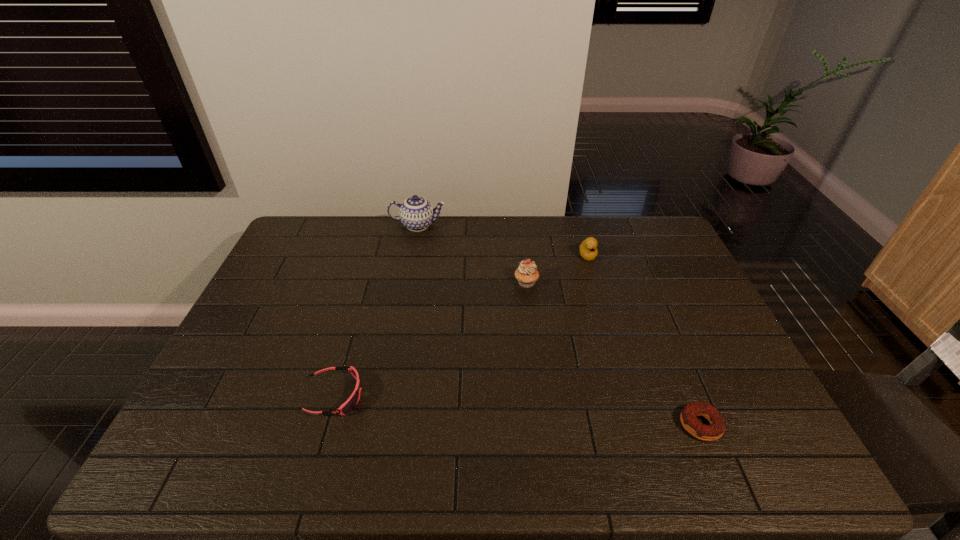
I want to click on the tallest object, so click(416, 213).

Identify the location of chinaware. (416, 213).

I want to click on the third object from right to left, so click(x=526, y=274).

Find the location of a particular element. This screenshot has height=540, width=960. the third nearest object is located at coordinates (526, 274).

Identify the location of the fourth object from left to right. The image size is (960, 540). (588, 251).

Locate an element on the screen. duckling is located at coordinates (588, 251).

Find the location of a particular element. The image size is (960, 540). the second shortest object is located at coordinates (346, 407).

Locate an element on the screen. the rightmost object is located at coordinates (688, 416).

Locate an element on the screen. The width and height of the screenshot is (960, 540). the shortest object is located at coordinates (688, 416).

At what (x,y) coordinates should I click in order to perform the action: click on free space located 0.300m at the spout of the tallest object. Please return your answer as a coordinate pair (x, y). This screenshot has width=960, height=540. Looking at the image, I should click on (526, 225).